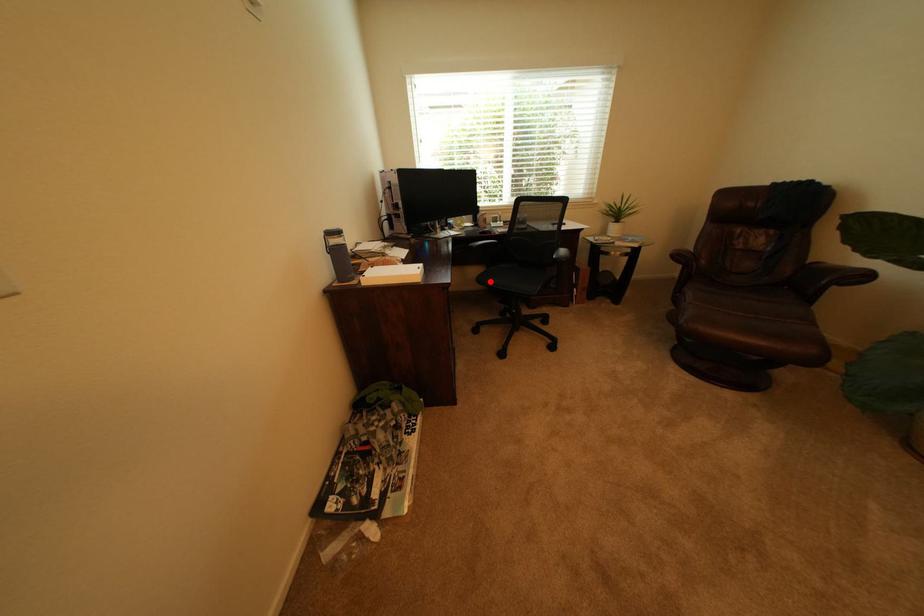
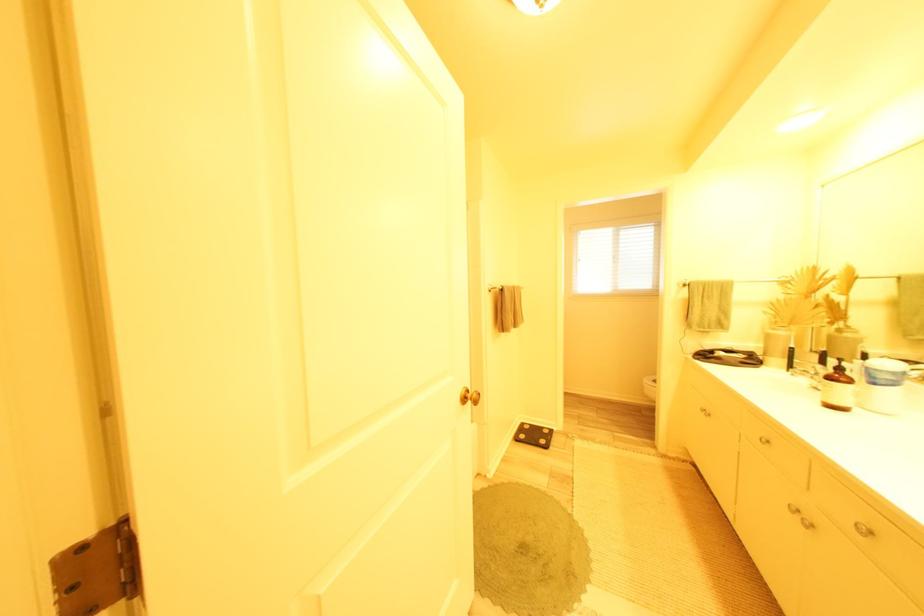
Question: I am providing you with two images of the same scene from different viewpoints. A red point is marked on the first image. Can you still see the location of the red point in image 2?

Choices:
 (A) Yes
 (B) No

Answer: (B)